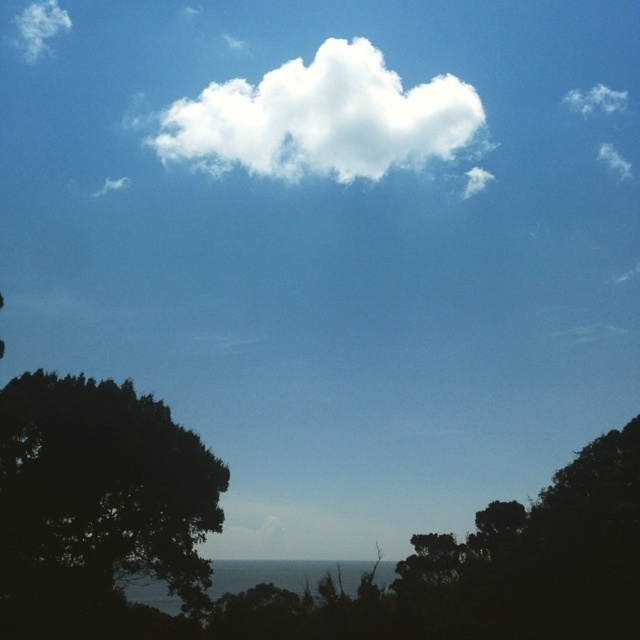
You are standing at the point closest to the bottom edge of the image. Which of the two points, point (13, 536) or point (60, 24), is closer to you?

Point (13, 536) is closer to you because it is in front of point (60, 24).

You are an astronomer analyzing the image. You need to locate the white fluffy cloud at upper center. What are its coordinates?

The white fluffy cloud at upper center is located at coordinates point [323,120].